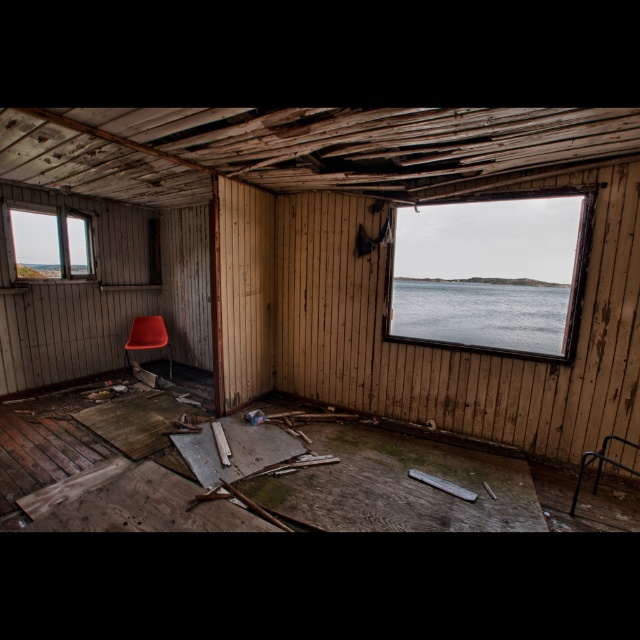
You are inside the dilapidated room and need to exit through the transparent glass window at upper left. Given that the window is at coordinates 0.381, 0.080, can you estimate its position relative to the room?

The transparent glass window at upper left is located at point [51,243], which places it in the upper left area of the room, near the ceiling and left wall.

You are standing in the dilapidated room and want to reach the red chair near the window. The room has debris scattered everywhere. There is a point at coordinates point (298, 148) that is 11.12 feet away from you. If you move straight towards the red chair, will you pass through this point?

The point at (298, 148) is 11.12 feet away from the viewer. Since the red chair is near the window and the debris is scattered, it is possible that moving straight towards the chair might pass through this point, but the exact path depends on the chair and window location. However, the description only states the distance to the point, not its relation to the chair. Therefore, we cannot confirm if moving towards the chair would pass through that point based on the given information.